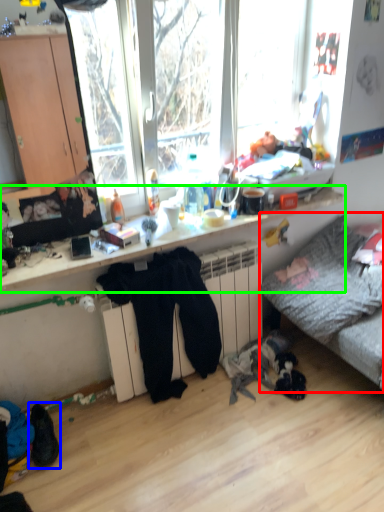
Question: Which is farther away from studio couch (highlighted by a red box)? footwear (highlighted by a blue box) or desk (highlighted by a green box)?

Choices:
 (A) footwear
 (B) desk

Answer: (A)